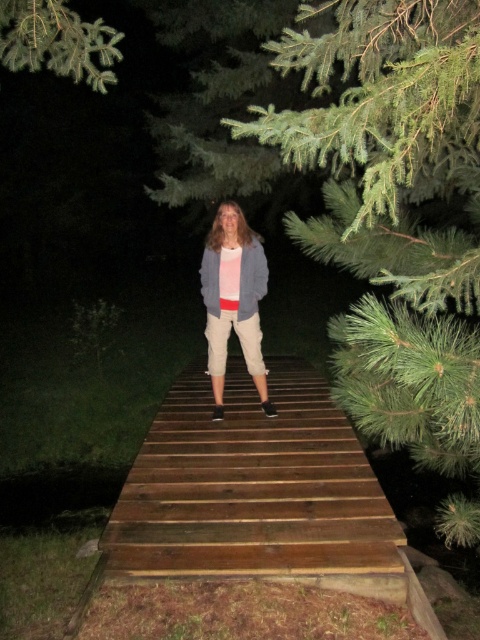
Question: Which object is the closest to the wooden bridge at center?

Choices:
 (A) light gray cotton hoodie at center
 (B) green needle-like leaves at upper left

Answer: (A)

Question: Does light gray cotton hoodie at center appear over green needle-like leaves at upper left?

Choices:
 (A) no
 (B) yes

Answer: (A)

Question: Does wooden bridge at center appear on the right side of green needle-like leaves at upper left?

Choices:
 (A) no
 (B) yes

Answer: (B)

Question: Is wooden bridge at center bigger than green needle-like leaves at upper left?

Choices:
 (A) no
 (B) yes

Answer: (B)

Question: Considering the real-world distances, which object is closest to the wooden bridge at center?

Choices:
 (A) green needle-like leaves at upper left
 (B) light gray cotton hoodie at center

Answer: (B)

Question: Based on their relative distances, which object is farther from the light gray cotton hoodie at center?

Choices:
 (A) wooden bridge at center
 (B) green needle-like leaves at upper left

Answer: (B)